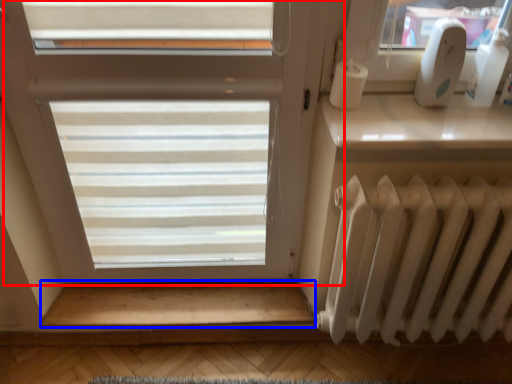
Question: Which object appears farthest to the camera in this image, window (highlighted by a red box) or stairwell (highlighted by a blue box)?

Choices:
 (A) window
 (B) stairwell

Answer: (B)